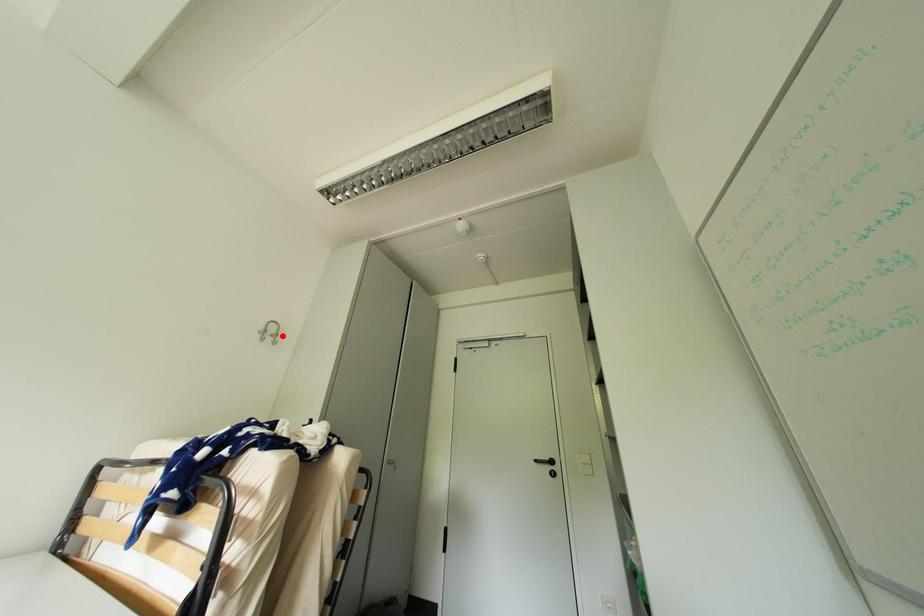
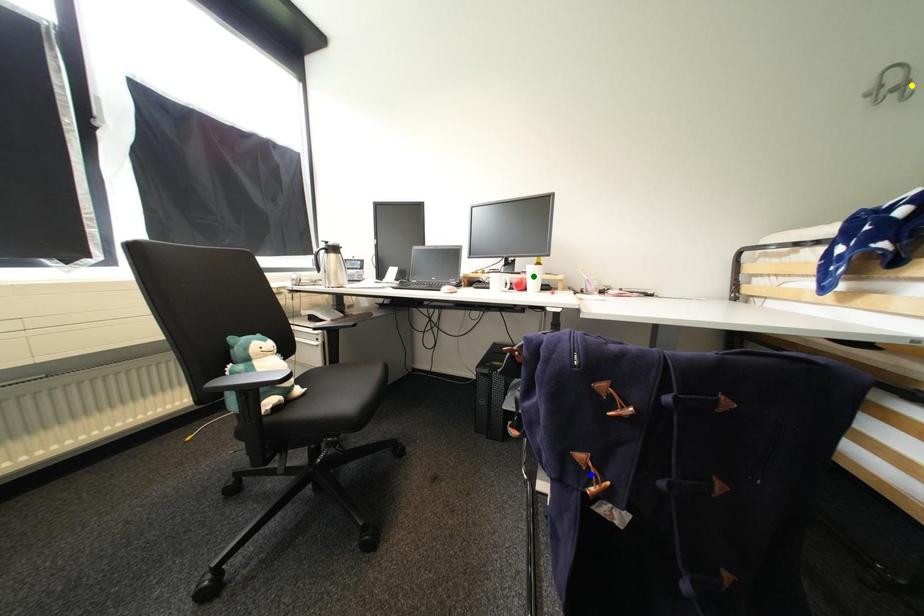
Question: I am providing you with two images of the same scene from different viewpoints. A red point is marked on the first image. You are given multiple points on the second image. Can you choose the point in image 2 that corresponds to the point in image 1?

Choices:
 (A) yellow point
 (B) blue point
 (C) green point

Answer: (A)